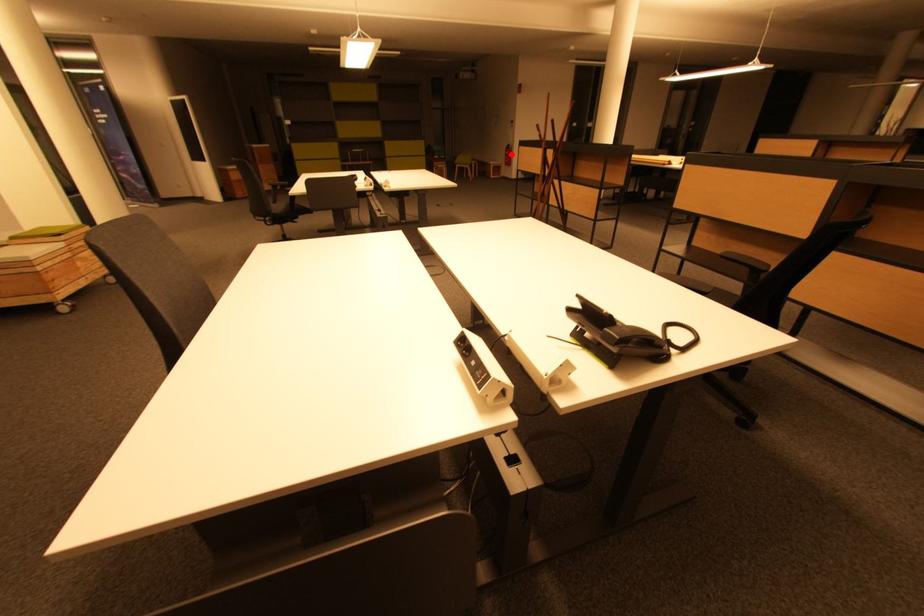
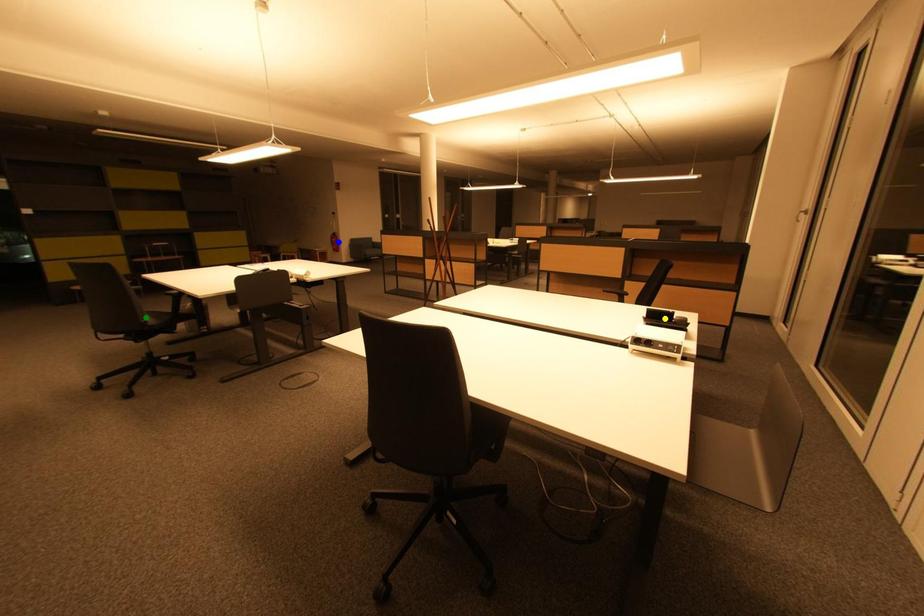
Question: I am providing you with two images of the same scene from different viewpoints. A red point is marked on the first image. You are given multiple points on the second image. Which point in image 2 represents the same 3d spot as the red point in image 1?

Choices:
 (A) green point
 (B) blue point
 (C) yellow point

Answer: (B)